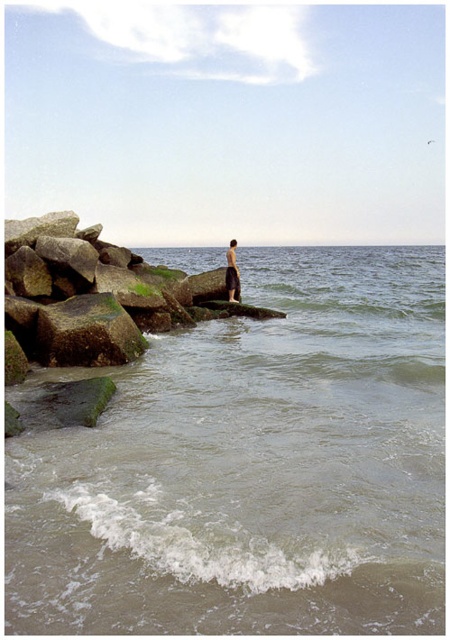
You are standing on the green mossy rock at left and want to throw a pebble to reach the skinny man at center. If your throwing distance is 8 meters, will the pebble reach him?

The green mossy rock at left is 8.19 meters from the skinny man at center. Since your throwing distance is 8 meters, the pebble will not reach him as the distance is slightly longer than your capability.